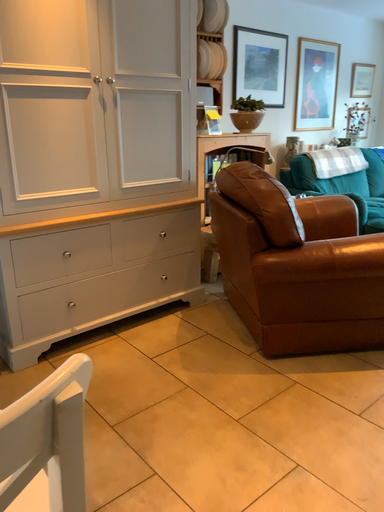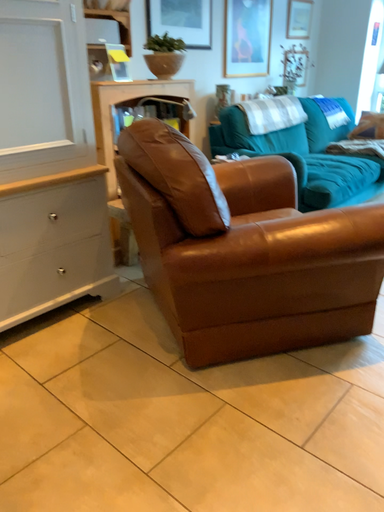
Question: Which way did the camera rotate in the video?

Choices:
 (A) rotated right
 (B) rotated left

Answer: (A)